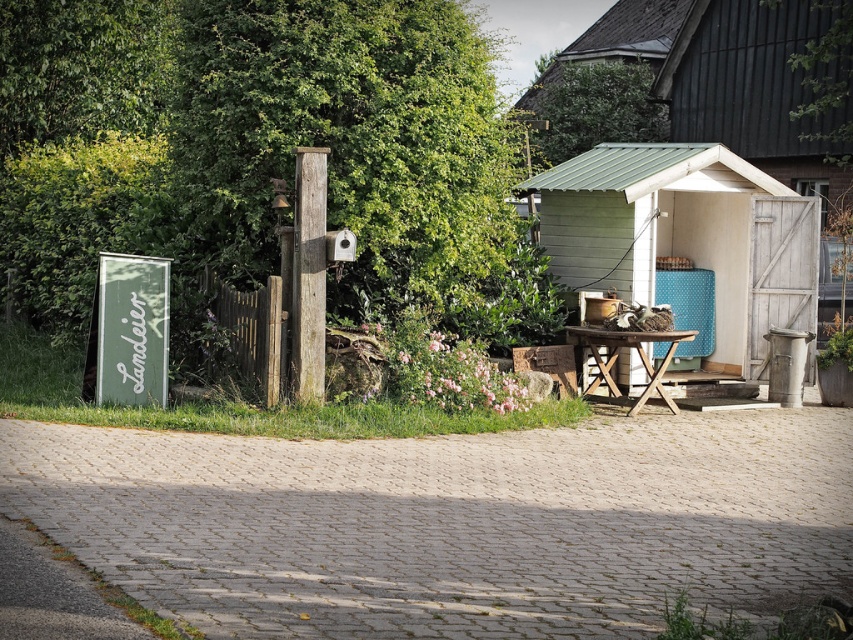
You are standing in the rural area looking at the scene. There is a green leafy tree at upper center and a weathered wood post at center. Which object is higher in the image?

The green leafy tree at upper center is higher because it is positioned above the weathered wood post at center.